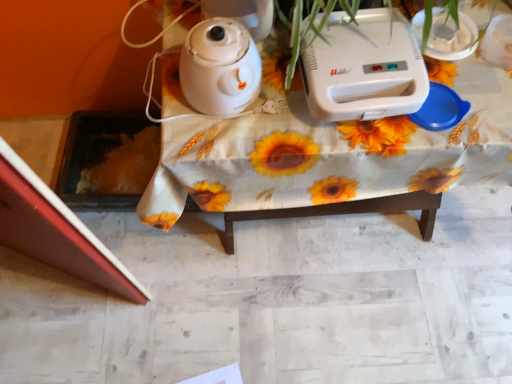
Find the location of a particular element. free space in front of white glossy kettle at upper center is located at coordinates (224, 142).